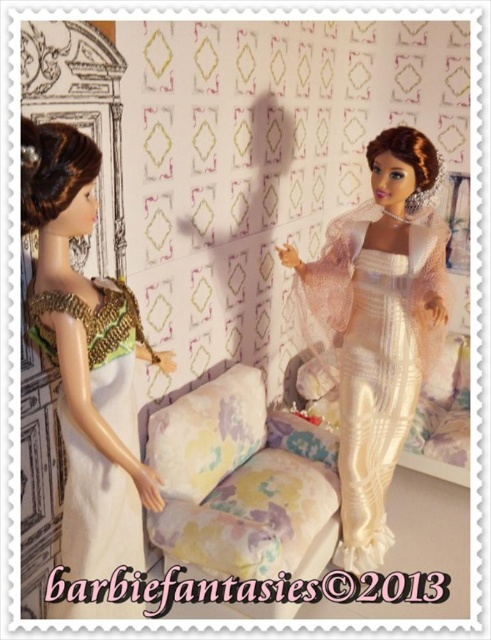
Question: Does ivory satin gown at center appear under green and gold fabric dress at left?

Choices:
 (A) yes
 (B) no

Answer: (B)

Question: Does ivory satin gown at center have a greater width compared to green and gold fabric dress at left?

Choices:
 (A) no
 (B) yes

Answer: (B)

Question: Does ivory satin gown at center lie in front of green and gold fabric dress at left?

Choices:
 (A) yes
 (B) no

Answer: (B)